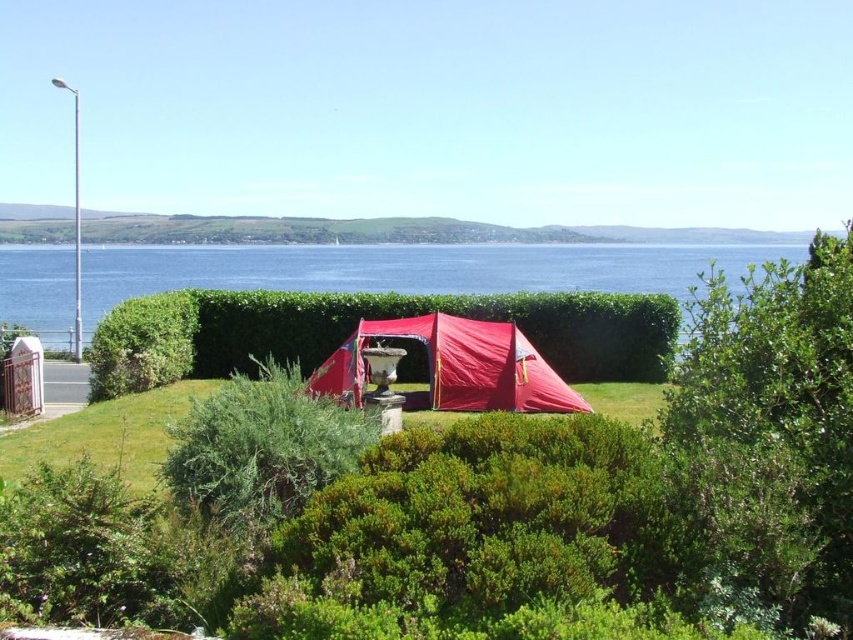
The height and width of the screenshot is (640, 853). What do you see at coordinates (357, 326) in the screenshot? I see `green leafy hedge at center` at bounding box center [357, 326].

Does green leafy hedge at center appear over green leafy bush at center?

Yes, green leafy hedge at center is above green leafy bush at center.

Locate an element on the screen. This screenshot has width=853, height=640. green leafy hedge at center is located at coordinates tap(357, 326).

Locate an element on the screen. The height and width of the screenshot is (640, 853). green leafy hedge at center is located at coordinates (357, 326).

Can you confirm if transparent water at center is thinner than matte red tent at center?

Incorrect, transparent water at center's width is not less than matte red tent at center's.

Who is positioned more to the right, transparent water at center or matte red tent at center?

Positioned to the right is transparent water at center.

Who is more distant from viewer, [210,244] or [575,404]?

The point [210,244] is behind.

The image size is (853, 640). I want to click on transparent water at center, so click(409, 268).

Between point (262, 268) and point (225, 449), which one is positioned in front?

Point (225, 449) is more forward.

Does transparent water at center appear on the right side of green leafy bush at center?

Yes, transparent water at center is to the right of green leafy bush at center.

What do you see at coordinates (409, 268) in the screenshot? I see `transparent water at center` at bounding box center [409, 268].

Identify the location of transparent water at center. Image resolution: width=853 pixels, height=640 pixels. (409, 268).